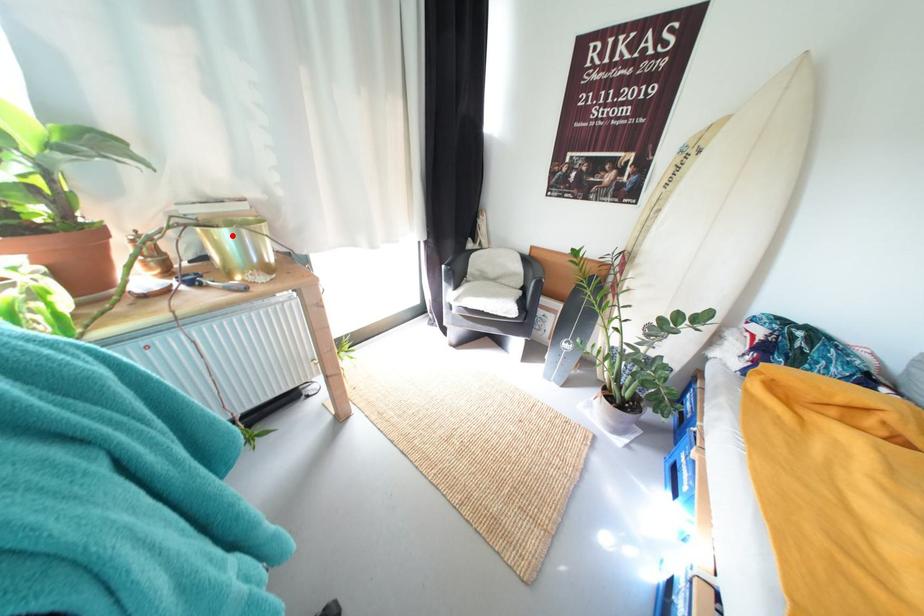
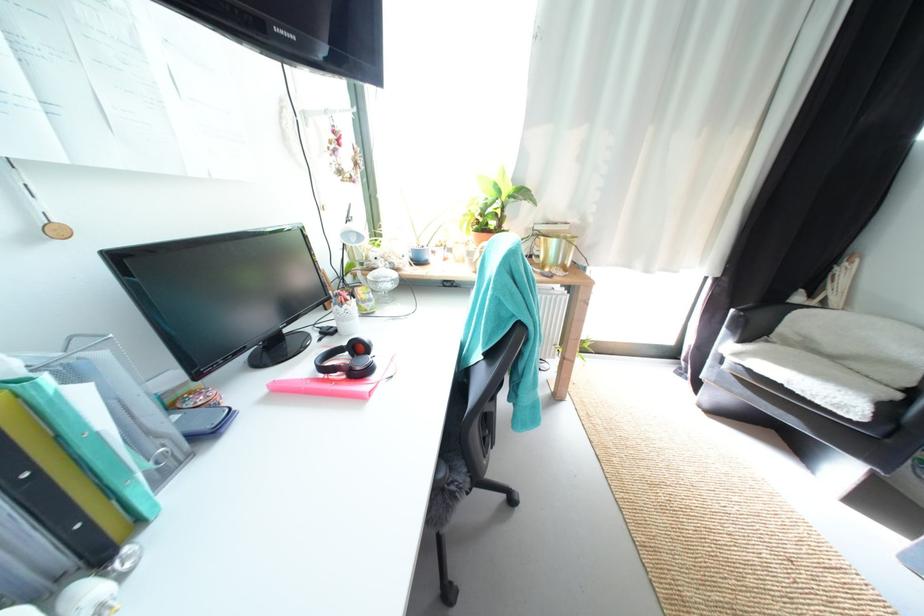
Where in the second image is the point corresponding to the highlighted location from the first image?

(562, 244)